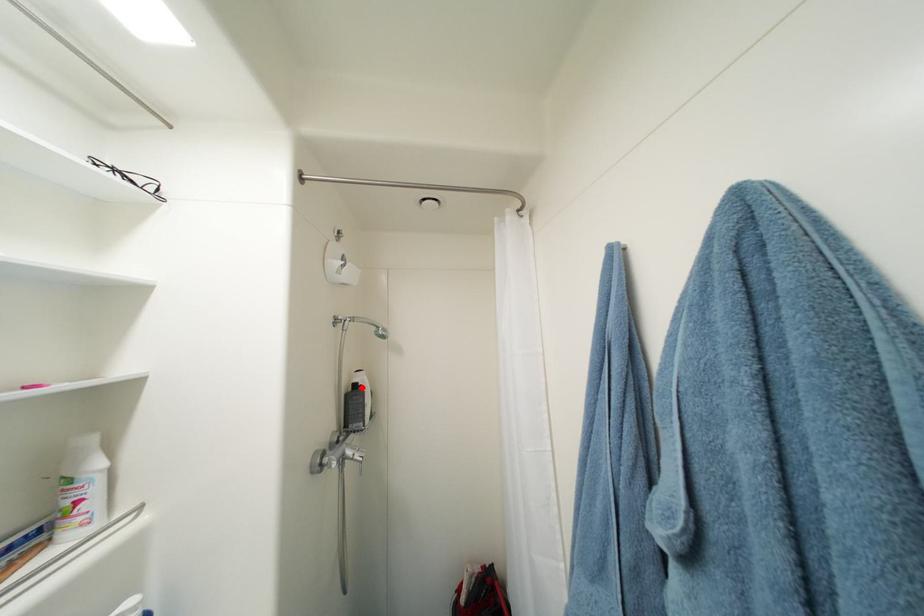
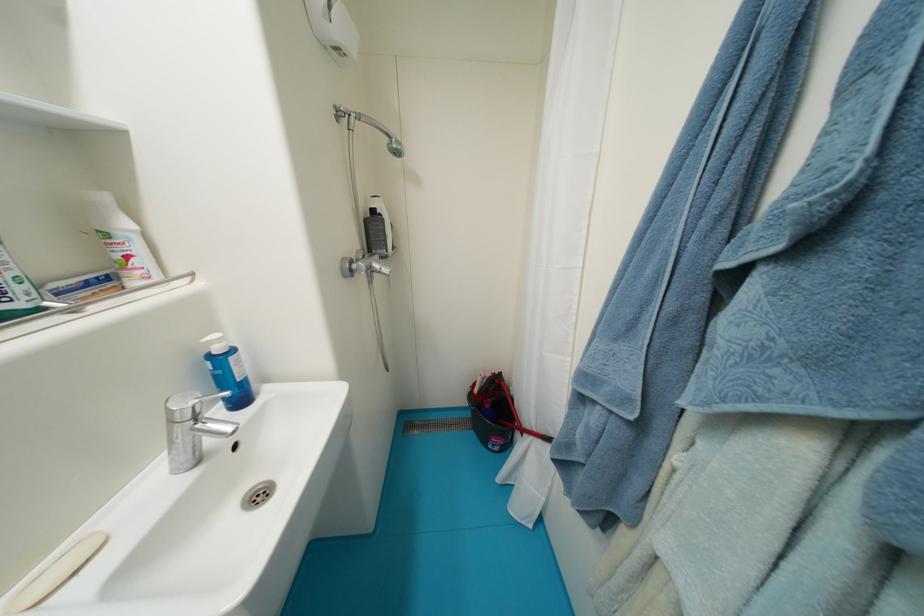
In the second image, find the point that corresponds to the highlighted location in the first image.

(380, 214)